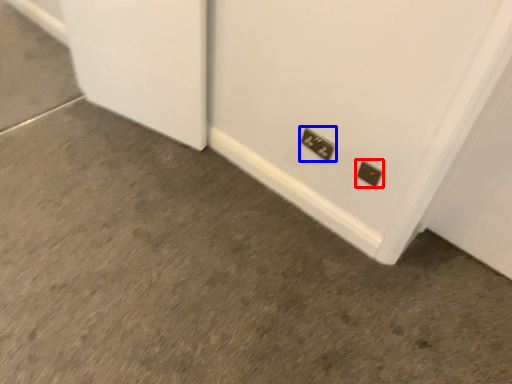
Question: Which object appears closest to the camera in this image, power plugs and sockets (highlighted by a red box) or power plugs and sockets (highlighted by a blue box)?

Choices:
 (A) power plugs and sockets
 (B) power plugs and sockets

Answer: (A)